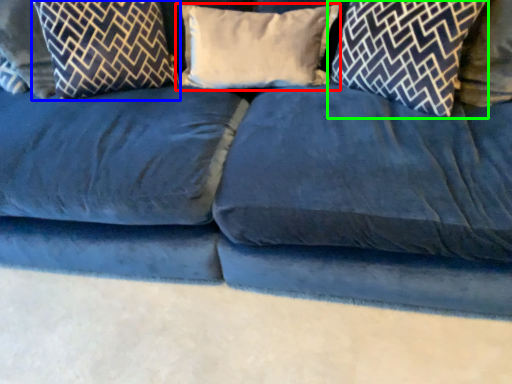
Question: Which object is positioned farthest from pillow (highlighted by a red box)? Select from pillow (highlighted by a blue box) and pillow (highlighted by a green box).

Choices:
 (A) pillow
 (B) pillow

Answer: (A)